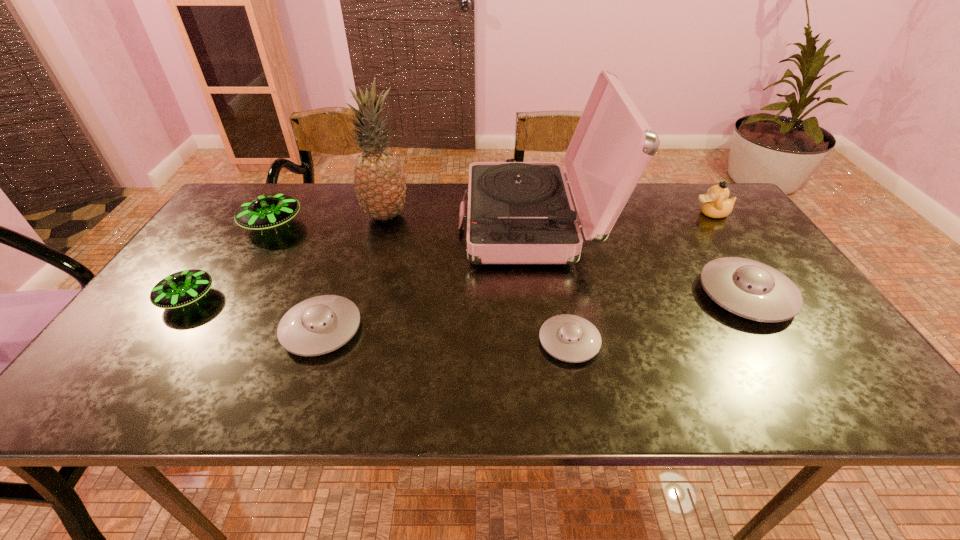
Locate an element on the screen. vacant position located on the front of the tallest saucer is located at coordinates (227, 300).

Where is `free spot located on the left of the rightmost gray saucer`? This screenshot has height=540, width=960. free spot located on the left of the rightmost gray saucer is located at coordinates (540, 294).

The height and width of the screenshot is (540, 960). Identify the location of free region located 0.130m on the back of the nearer green saucer. (223, 248).

At what (x,y) coordinates should I click in order to perform the action: click on vacant space located on the right of the leftmost gray saucer. Please return your answer as a coordinate pair (x, y). The width and height of the screenshot is (960, 540). Looking at the image, I should click on (492, 329).

Locate an element on the screen. This screenshot has width=960, height=540. vacant space situated 0.080m on the left of the shortest saucer is located at coordinates (503, 342).

The image size is (960, 540). I want to click on pineapple present at the far edge, so click(379, 180).

Identify the location of record player present at the far edge. (518, 212).

Where is `duckling at the far edge`? duckling at the far edge is located at coordinates (716, 204).

Where is `saucer at the far edge`? This screenshot has height=540, width=960. saucer at the far edge is located at coordinates (268, 211).

You are a GUI agent. You are given a task and a screenshot of the screen. Output one action in this format:
    pyautogui.click(x=<x>, y=<y>)
    Task: Click on the duckling that is at the right edge
    
    Given the screenshot: What is the action you would take?
    [716, 204]